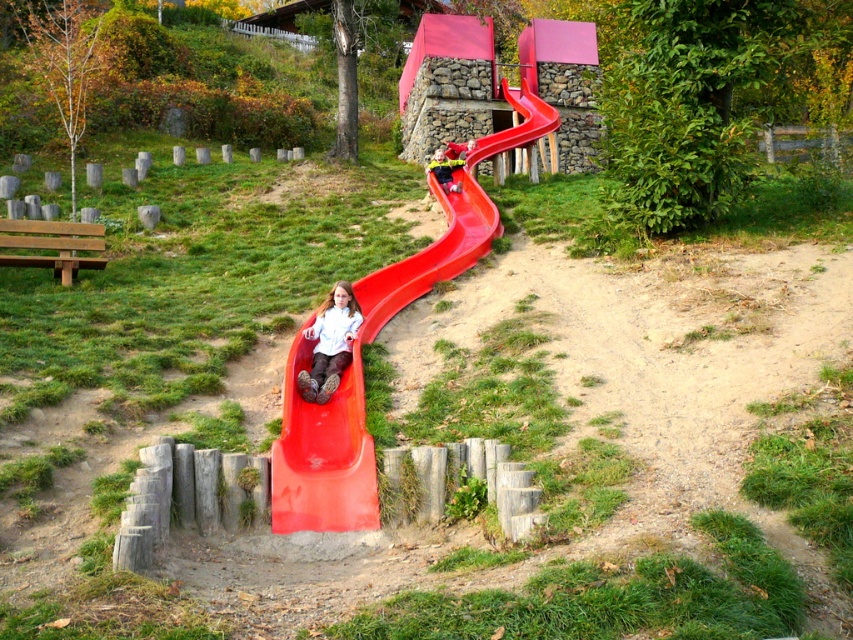
Can you confirm if smooth plastic slide at lower left is taller than matte white shirt at center?

Correct, smooth plastic slide at lower left is much taller as matte white shirt at center.

Which is more to the left, smooth plastic slide at lower left or matte white shirt at center?

matte white shirt at center is more to the left.

Find the location of a particular element. smooth plastic slide at lower left is located at coordinates (363, 380).

Can you confirm if smooth plastic slide at lower left is positioned above matte red slide at center?

No.

Between smooth plastic slide at lower left and matte red slide at center, which one has more height?

smooth plastic slide at lower left

In the scene shown: Who is more distant from viewer, (473,204) or (457,164)?

Positioned behind is point (457,164).

This screenshot has width=853, height=640. What are the coordinates of `smooth plastic slide at lower left` in the screenshot? It's located at (363, 380).

Describe the element at coordinates (329, 342) in the screenshot. The width and height of the screenshot is (853, 640). I see `matte white shirt at center` at that location.

Does point (316, 365) come in front of point (456, 154)?

Yes, point (316, 365) is in front of point (456, 154).

Is point (318, 314) less distant than point (456, 160)?

Yes, it is in front of point (456, 160).

Where is `matte white shirt at center`? Image resolution: width=853 pixels, height=640 pixels. matte white shirt at center is located at coordinates (329, 342).